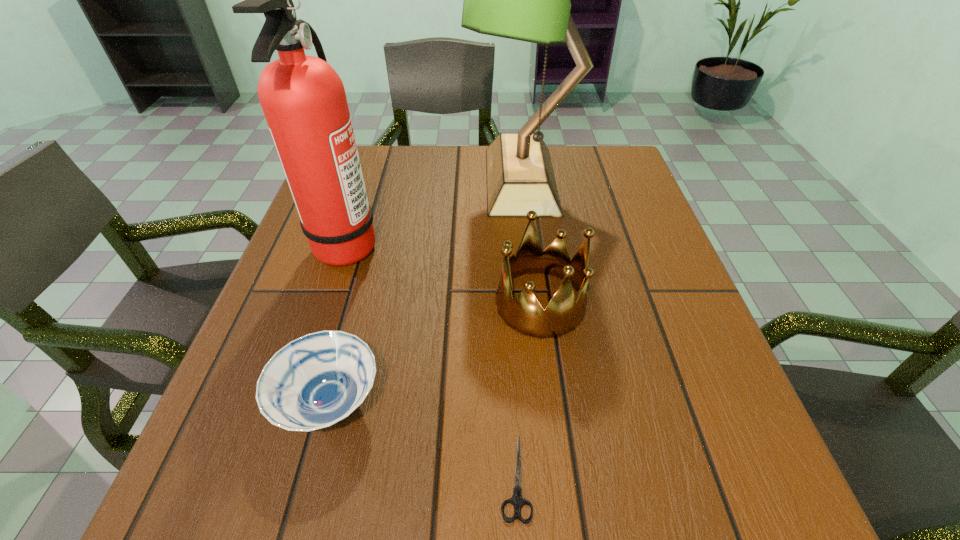
Locate which object is the third closest to the shortest object. Please provide its 2D coordinates. Your answer should be formatted as a tuple, i.e. [(x, y)], where the tuple contains the x and y coordinates of a point satisfying the conditions above.

[(303, 99)]

This screenshot has height=540, width=960. I want to click on free point that satisfies the following two spatial constraints: 1. on the back side of the crown; 2. on the metallic stand of the table lamp, so click(x=524, y=180).

Image resolution: width=960 pixels, height=540 pixels. What are the coordinates of `blank area in the image that satisfies the following two spatial constraints: 1. on the handle side of the fire extinguisher; 2. on the left side of the shears` in the screenshot? It's located at (271, 477).

You are a GUI agent. You are given a task and a screenshot of the screen. Output one action in this format:
    pyautogui.click(x=<x>, y=<y>)
    Task: Click on the blank area in the image that satisfies the following two spatial constraints: 1. on the handle side of the fire extinguisher; 2. on the right side of the crown
    
    Given the screenshot: What is the action you would take?
    pyautogui.click(x=328, y=303)

In order to click on vacant space that satisfies the following two spatial constraints: 1. on the handle side of the fourth tallest object; 2. on the right side of the fire extinguisher in this screenshot , I will do `click(295, 403)`.

The image size is (960, 540). What are the coordinates of `blank area in the image that satisfies the following two spatial constraints: 1. on the metallic stand of the third shortest object; 2. on the right side of the table lamp` in the screenshot? It's located at (536, 303).

Locate an element on the screen. free space that satisfies the following two spatial constraints: 1. on the handle side of the third tallest object; 2. on the left side of the fire extinguisher is located at coordinates click(328, 303).

Find the location of a particular element. vacant space that satisfies the following two spatial constraints: 1. on the handle side of the fire extinguisher; 2. on the left side of the soup bowl is located at coordinates (295, 403).

Find the location of a particular element. Image resolution: width=960 pixels, height=540 pixels. free spot that satisfies the following two spatial constraints: 1. on the handle side of the fire extinguisher; 2. on the right side of the soup bowl is located at coordinates (295, 403).

In order to click on free location that satisfies the following two spatial constraints: 1. on the back side of the soup bowl; 2. on the right side of the third tallest object in this screenshot , I will do `click(356, 303)`.